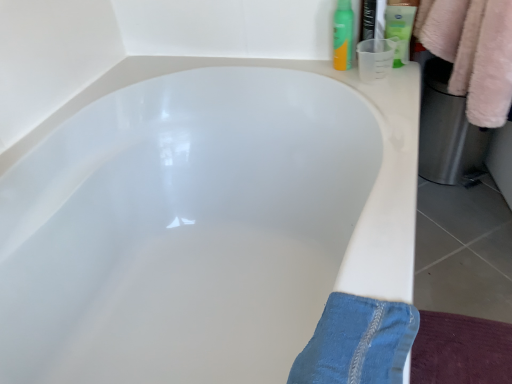
Locate an element on the screen. The height and width of the screenshot is (384, 512). denim at lower right is located at coordinates (358, 342).

Identify the location of white glossy bathtub at center. This screenshot has width=512, height=384. (205, 222).

From the image's perspective, which one is positioned higher, green matte lotion at upper right, acting as the 1th toiletry starting from the right, or white glossy bathtub at center?

green matte lotion at upper right, acting as the 1th toiletry starting from the right, from the image's perspective.

Considering the sizes of green matte lotion at upper right, acting as the 1th toiletry starting from the right, and white glossy bathtub at center in the image, is green matte lotion at upper right, acting as the 1th toiletry starting from the right, taller or shorter than white glossy bathtub at center?

green matte lotion at upper right, acting as the 1th toiletry starting from the right, is shorter than white glossy bathtub at center.

Considering the relative sizes of green matte lotion at upper right, acting as the second toiletry starting from the left, and white glossy bathtub at center in the image provided, is green matte lotion at upper right, acting as the second toiletry starting from the left, thinner than white glossy bathtub at center?

Indeed, green matte lotion at upper right, acting as the second toiletry starting from the left, has a lesser width compared to white glossy bathtub at center.

Is green matte lotion at upper right, acting as the second toiletry starting from the left, oriented away from white glossy bathtub at center?

No, white glossy bathtub at center is not at the back of green matte lotion at upper right, acting as the second toiletry starting from the left.

From the image's perspective, who appears lower, green matte spray can at upper right, marked as the first toiletry in a left-to-right arrangement, or white glossy bathtub at center?

white glossy bathtub at center appears lower in the image.

How distant is green matte spray can at upper right, marked as the second toiletry in a right-to-left arrangement, from white glossy bathtub at center?

green matte spray can at upper right, marked as the second toiletry in a right-to-left arrangement, is 21.36 inches away from white glossy bathtub at center.

Looking at the image, does green matte spray can at upper right, marked as the first toiletry in a left-to-right arrangement, seem bigger or smaller compared to white glossy bathtub at center?

Clearly, green matte spray can at upper right, marked as the first toiletry in a left-to-right arrangement, is smaller in size than white glossy bathtub at center.

From a real-world perspective, which object stands above the other?

green matte lotion at upper right, acting as the 1th toiletry starting from the right.

Considering the relative positions of green matte lotion at upper right, acting as the second toiletry starting from the left, and denim at lower right in the image provided, is green matte lotion at upper right, acting as the second toiletry starting from the left, behind denim at lower right?

Yes.

Would you consider green matte lotion at upper right, acting as the second toiletry starting from the left, to be distant from denim at lower right?

They are positioned close to each other.

Is denim at lower right surrounded by green matte lotion at upper right, acting as the 1th toiletry starting from the right?

No.

Is green matte spray can at upper right, marked as the second toiletry in a right-to-left arrangement, outside of green matte lotion at upper right, acting as the second toiletry starting from the left?

green matte spray can at upper right, marked as the second toiletry in a right-to-left arrangement, lies outside green matte lotion at upper right, acting as the second toiletry starting from the left,'s area.

Considering the sizes of green matte spray can at upper right, marked as the first toiletry in a left-to-right arrangement, and green matte lotion at upper right, acting as the second toiletry starting from the left, in the image, is green matte spray can at upper right, marked as the first toiletry in a left-to-right arrangement, wider or thinner than green matte lotion at upper right, acting as the second toiletry starting from the left,?

green matte spray can at upper right, marked as the first toiletry in a left-to-right arrangement, is thinner than green matte lotion at upper right, acting as the second toiletry starting from the left.

Considering the sizes of green matte spray can at upper right, marked as the second toiletry in a right-to-left arrangement, and green matte lotion at upper right, acting as the second toiletry starting from the left, in the image, is green matte spray can at upper right, marked as the second toiletry in a right-to-left arrangement, bigger or smaller than green matte lotion at upper right, acting as the second toiletry starting from the left,?

Clearly, green matte spray can at upper right, marked as the second toiletry in a right-to-left arrangement, is larger in size than green matte lotion at upper right, acting as the second toiletry starting from the left.

You are a GUI agent. You are given a task and a screenshot of the screen. Output one action in this format:
    pyautogui.click(x=<x>, y=<y>)
    Task: Click on the toiletry below the green matte spray can at upper right, marked as the first toiletry in a left-to-right arrangement (from a real-world perspective)
    The image size is (512, 384).
    Given the screenshot: What is the action you would take?
    pyautogui.click(x=400, y=27)

Considering their positions, is denim at lower right located in front of or behind green matte spray can at upper right, marked as the second toiletry in a right-to-left arrangement?

denim at lower right is in front of green matte spray can at upper right, marked as the second toiletry in a right-to-left arrangement.

Is denim at lower right inside the boundaries of green matte spray can at upper right, marked as the first toiletry in a left-to-right arrangement, or outside?

denim at lower right exists outside the volume of green matte spray can at upper right, marked as the first toiletry in a left-to-right arrangement.

Consider the image. Could you measure the distance between denim at lower right and green matte spray can at upper right, marked as the first toiletry in a left-to-right arrangement?

denim at lower right is 30.32 inches away from green matte spray can at upper right, marked as the first toiletry in a left-to-right arrangement.

Considering the sizes of objects denim at lower right and green matte spray can at upper right, marked as the second toiletry in a right-to-left arrangement, in the image provided, who is taller, denim at lower right or green matte spray can at upper right, marked as the second toiletry in a right-to-left arrangement,?

green matte spray can at upper right, marked as the second toiletry in a right-to-left arrangement.

Considering the relative sizes of green matte lotion at upper right, acting as the 1th toiletry starting from the right, and green matte spray can at upper right, marked as the first toiletry in a left-to-right arrangement, in the image provided, is green matte lotion at upper right, acting as the 1th toiletry starting from the right, shorter than green matte spray can at upper right, marked as the first toiletry in a left-to-right arrangement,?

Yes.

Consider the image. In terms of size, does green matte lotion at upper right, acting as the second toiletry starting from the left, appear bigger or smaller than green matte spray can at upper right, marked as the first toiletry in a left-to-right arrangement?

green matte lotion at upper right, acting as the second toiletry starting from the left, is smaller than green matte spray can at upper right, marked as the first toiletry in a left-to-right arrangement.

At what (x,y) coordinates should I click in order to perform the action: click on toiletry in front of the green matte spray can at upper right, marked as the first toiletry in a left-to-right arrangement. Please return your answer as a coordinate pair (x, y). The width and height of the screenshot is (512, 384). Looking at the image, I should click on (400, 27).

Does point (390, 20) come farther from viewer compared to point (342, 33)?

No, (390, 20) is in front of (342, 33).

Does denim at lower right appear on the right side of white glossy bathtub at center?

Yes, denim at lower right is to the right of white glossy bathtub at center.

Which point is more distant from viewer, (375, 374) or (153, 295)?

The point (153, 295) is farther from the camera.

Can you confirm if denim at lower right is wider than white glossy bathtub at center?

No.

Where is `bathtub that appears in front of the green matte lotion at upper right, acting as the 1th toiletry starting from the right`? This screenshot has width=512, height=384. bathtub that appears in front of the green matte lotion at upper right, acting as the 1th toiletry starting from the right is located at coordinates (205, 222).

At what (x,y) coordinates should I click in order to perform the action: click on bathtub that appears below the green matte spray can at upper right, marked as the first toiletry in a left-to-right arrangement (from a real-world perspective). Please return your answer as a coordinate pair (x, y). The height and width of the screenshot is (384, 512). Looking at the image, I should click on (205, 222).

Looking at the image, which one is located further to green matte spray can at upper right, marked as the second toiletry in a right-to-left arrangement, denim at lower right or white glossy bathtub at center?

The object further to green matte spray can at upper right, marked as the second toiletry in a right-to-left arrangement, is denim at lower right.

When comparing their distances from white glossy bathtub at center, does denim at lower right or green matte spray can at upper right, marked as the second toiletry in a right-to-left arrangement, seem further?

denim at lower right is further to white glossy bathtub at center.

Which object lies nearer to the anchor point white glossy bathtub at center, green matte spray can at upper right, marked as the first toiletry in a left-to-right arrangement, or green matte lotion at upper right, acting as the 1th toiletry starting from the right?

green matte spray can at upper right, marked as the first toiletry in a left-to-right arrangement, is positioned closer to the anchor white glossy bathtub at center.

Based on the photo, from the image, which object appears to be farther from green matte lotion at upper right, acting as the 1th toiletry starting from the right, denim at lower right or green matte spray can at upper right, marked as the first toiletry in a left-to-right arrangement?

Among the two, denim at lower right is located further to green matte lotion at upper right, acting as the 1th toiletry starting from the right.

Estimate the real-world distances between objects in this image. Which object is closer to green matte lotion at upper right, acting as the second toiletry starting from the left, white glossy bathtub at center or denim at lower right?

white glossy bathtub at center.

Based on their spatial positions, is denim at lower right or green matte lotion at upper right, acting as the second toiletry starting from the left, further from green matte spray can at upper right, marked as the first toiletry in a left-to-right arrangement?

denim at lower right.

Looking at the image, which one is located further to green matte lotion at upper right, acting as the second toiletry starting from the left, green matte spray can at upper right, marked as the second toiletry in a right-to-left arrangement, or denim at lower right?

Based on the image, denim at lower right appears to be further to green matte lotion at upper right, acting as the second toiletry starting from the left.

From the image, which object appears to be farther from green matte lotion at upper right, acting as the second toiletry starting from the left, white glossy bathtub at center or green matte spray can at upper right, marked as the first toiletry in a left-to-right arrangement?

white glossy bathtub at center is further to green matte lotion at upper right, acting as the second toiletry starting from the left.

In order to click on bathtub located between denim at lower right and green matte lotion at upper right, acting as the 1th toiletry starting from the right, in the depth direction in this screenshot , I will do `click(205, 222)`.

Where is `bathtub between denim at lower right and green matte spray can at upper right, marked as the first toiletry in a left-to-right arrangement, along the z-axis`? Image resolution: width=512 pixels, height=384 pixels. bathtub between denim at lower right and green matte spray can at upper right, marked as the first toiletry in a left-to-right arrangement, along the z-axis is located at coordinates (205, 222).

I want to click on toiletry between white glossy bathtub at center and green matte spray can at upper right, marked as the first toiletry in a left-to-right arrangement, along the z-axis, so click(400, 27).

Where is `toiletry between denim at lower right and green matte spray can at upper right, marked as the second toiletry in a right-to-left arrangement, along the z-axis`? toiletry between denim at lower right and green matte spray can at upper right, marked as the second toiletry in a right-to-left arrangement, along the z-axis is located at coordinates (400, 27).